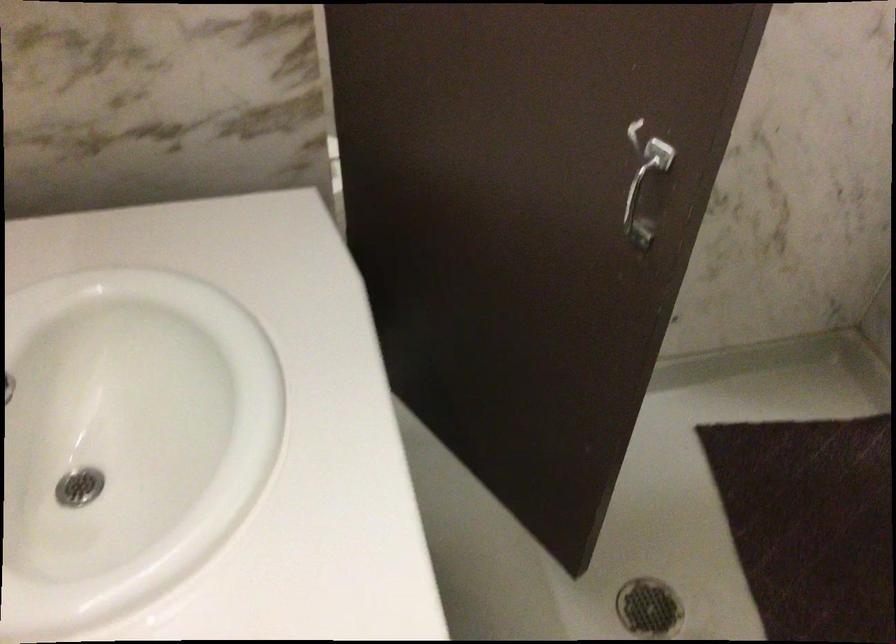
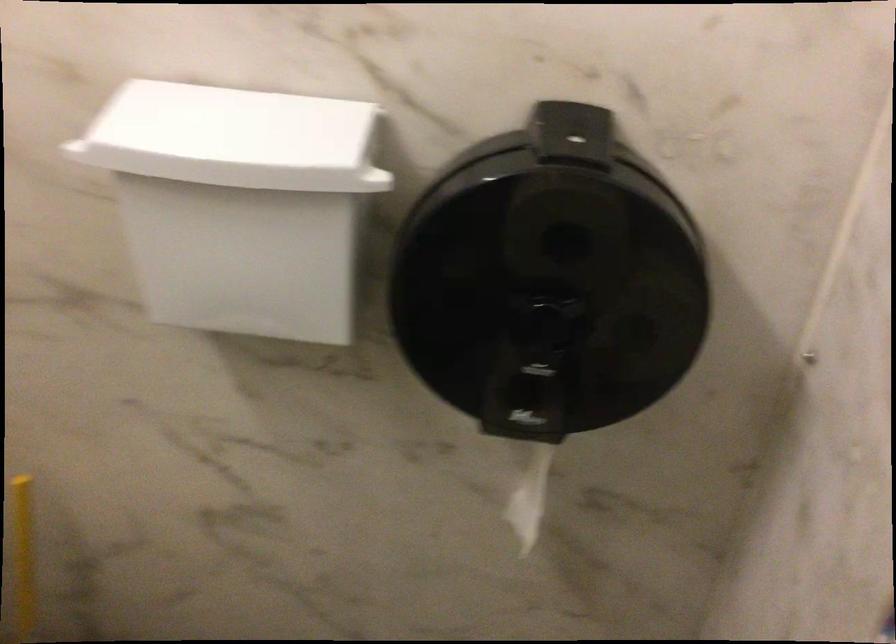
Question: What movement of the cameraman would produce the second image?

Choices:
 (A) Left
 (B) Right
 (C) Forward
 (D) Backward

Answer: (C)